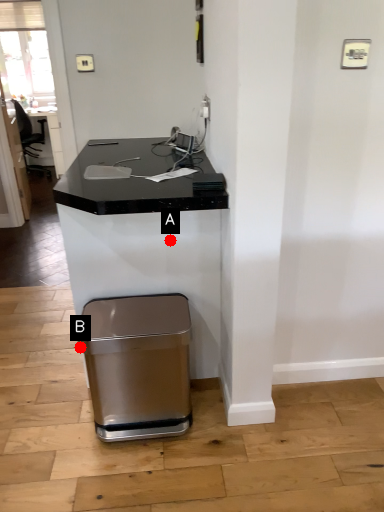
Question: Two points are circled on the image, labeled by A and B beside each circle. Which of the following is the closest to the observer?

Choices:
 (A) A is closer
 (B) B is closer

Answer: (B)